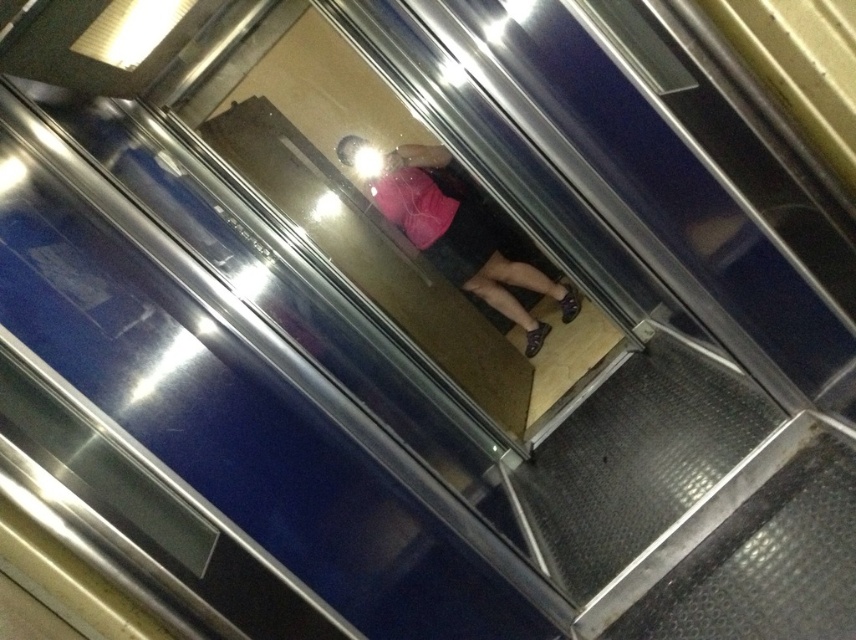
Question: Which object appears farthest from the camera in this image?

Choices:
 (A) pink matte shirt at center
 (B) metallic textured stair at lower right

Answer: (A)

Question: Can you confirm if metallic textured stair at lower right is positioned below pink matte shirt at center?

Choices:
 (A) yes
 (B) no

Answer: (A)

Question: Among these points, which one is farthest from the camera?

Choices:
 (A) (409, 161)
 (B) (560, 522)

Answer: (A)

Question: Is metallic textured stair at lower right above pink matte shirt at center?

Choices:
 (A) no
 (B) yes

Answer: (A)

Question: Which point is farther to the camera?

Choices:
 (A) (670, 344)
 (B) (357, 148)

Answer: (B)

Question: Is metallic textured stair at lower right smaller than pink matte shirt at center?

Choices:
 (A) yes
 (B) no

Answer: (B)